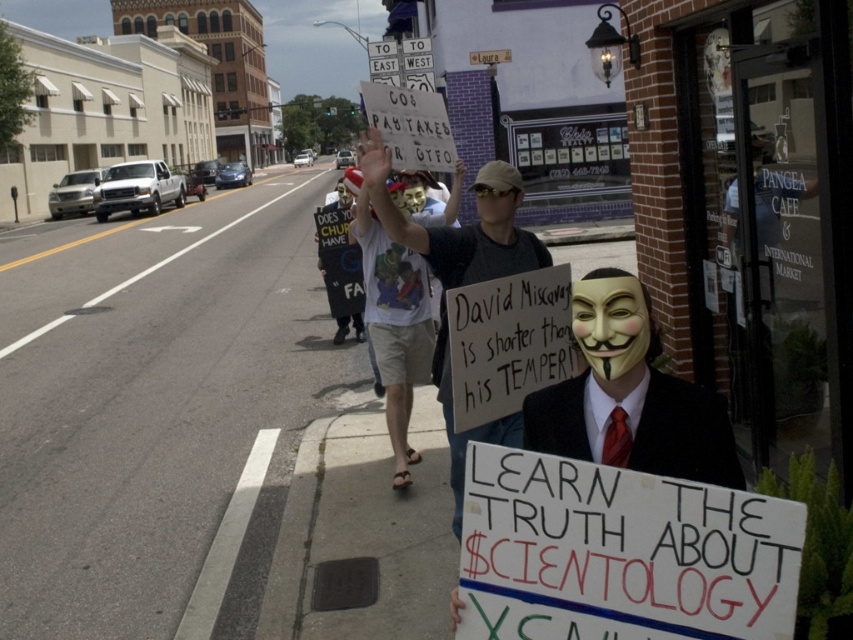
You are a photographer standing at the point with coordinates point [689,609]. You want to take a photo of the protest sign held by the person at point [361,161]. Is there any obstruction between you and the sign?

Point [689,609] is in front of point [361,161], so there is an obstruction between you and the sign at point [361,161].